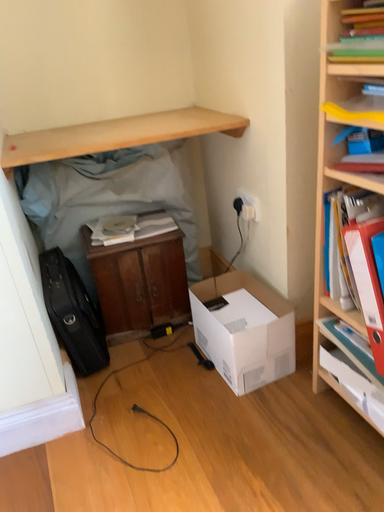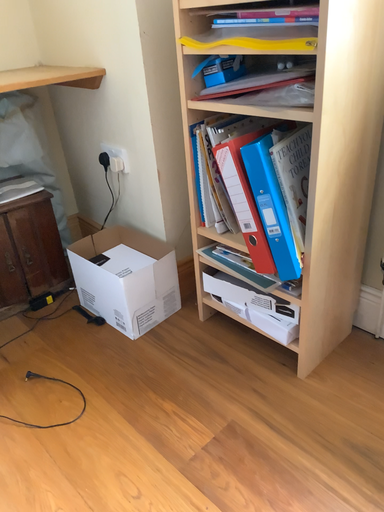
Question: Which way did the camera rotate in the video?

Choices:
 (A) rotated right
 (B) rotated left

Answer: (A)